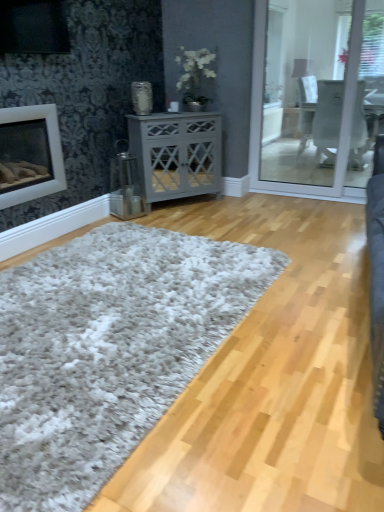
Question: Should I look upward or downward to see gray matte cabinet at center?

Choices:
 (A) up
 (B) down

Answer: (A)

Question: Is gray matte cabinet at center smaller than white shaggy rug at center?

Choices:
 (A) no
 (B) yes

Answer: (B)

Question: From a real-world perspective, is gray matte cabinet at center located higher than white shaggy rug at center?

Choices:
 (A) yes
 (B) no

Answer: (A)

Question: Does gray matte cabinet at center have a lesser height compared to white shaggy rug at center?

Choices:
 (A) yes
 (B) no

Answer: (B)

Question: From the image's perspective, is gray matte cabinet at center located beneath white shaggy rug at center?

Choices:
 (A) no
 (B) yes

Answer: (A)

Question: Does gray matte cabinet at center have a greater height compared to white shaggy rug at center?

Choices:
 (A) yes
 (B) no

Answer: (A)

Question: Is gray matte cabinet at center bigger than white shaggy rug at center?

Choices:
 (A) no
 (B) yes

Answer: (A)

Question: Is there a large distance between white matte fireplace at left and white shaggy rug at center?

Choices:
 (A) no
 (B) yes

Answer: (B)

Question: Is white matte fireplace at left oriented away from white shaggy rug at center?

Choices:
 (A) yes
 (B) no

Answer: (B)

Question: Does white matte fireplace at left appear on the right side of white shaggy rug at center?

Choices:
 (A) yes
 (B) no

Answer: (B)

Question: Is the depth of white matte fireplace at left less than that of white shaggy rug at center?

Choices:
 (A) no
 (B) yes

Answer: (A)

Question: Are white matte fireplace at left and white shaggy rug at center making contact?

Choices:
 (A) yes
 (B) no

Answer: (B)

Question: Considering the relative sizes of white matte fireplace at left and white shaggy rug at center in the image provided, is white matte fireplace at left bigger than white shaggy rug at center?

Choices:
 (A) no
 (B) yes

Answer: (A)

Question: Does white shaggy rug at center have a greater width compared to white matte fireplace at left?

Choices:
 (A) no
 (B) yes

Answer: (B)